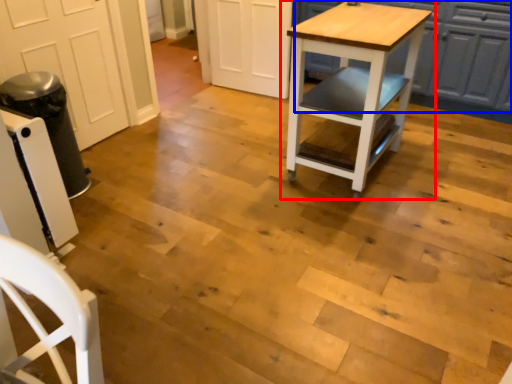
Question: Which of the following is the farthest to the observer, table (highlighted by a red box) or cabinetry (highlighted by a blue box)?

Choices:
 (A) table
 (B) cabinetry

Answer: (B)